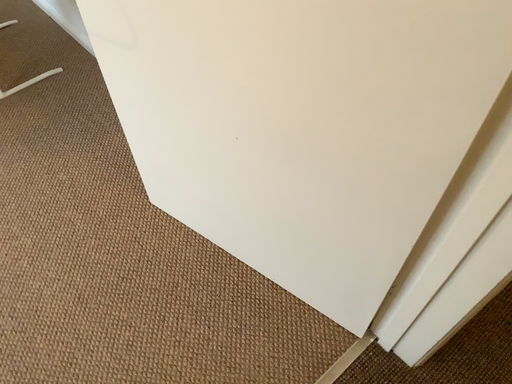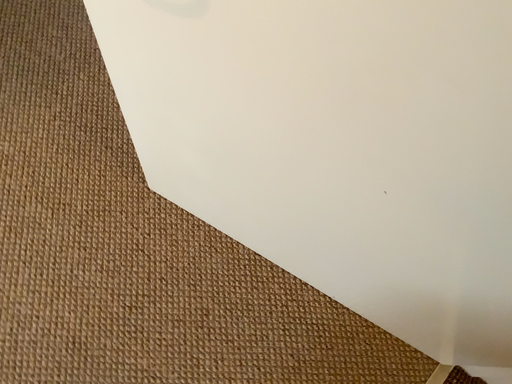
Question: Which way did the camera rotate in the video?

Choices:
 (A) rotated upward
 (B) rotated downward

Answer: (B)